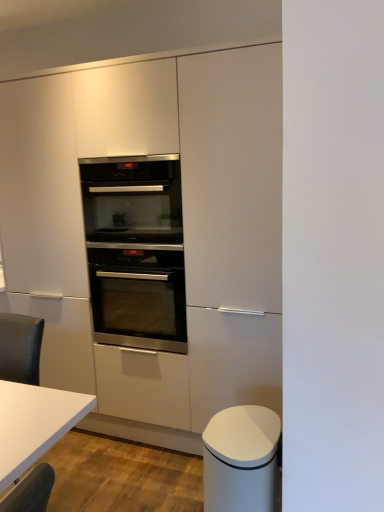
Question: Does satin white cabinet at center, the first cabinetry when ordered from back to front, have a larger size compared to white matte trash can at lower right, marked as the 2th cabinetry in a back-to-front arrangement?

Choices:
 (A) yes
 (B) no

Answer: (A)

Question: Considering the relative sizes of satin white cabinet at center, the first cabinetry when ordered from back to front, and white matte trash can at lower right, marked as the 2th cabinetry in a back-to-front arrangement, in the image provided, is satin white cabinet at center, the first cabinetry when ordered from back to front, taller than white matte trash can at lower right, marked as the 2th cabinetry in a back-to-front arrangement,?

Choices:
 (A) yes
 (B) no

Answer: (A)

Question: Is satin white cabinet at center, the 2th cabinetry viewed from the front, wider than white matte trash can at lower right, the first cabinetry from the front?

Choices:
 (A) no
 (B) yes

Answer: (B)

Question: Could you tell me if satin white cabinet at center, the first cabinetry when ordered from back to front, is facing white matte trash can at lower right, the first cabinetry from the front?

Choices:
 (A) no
 (B) yes

Answer: (B)

Question: From the image's perspective, is satin white cabinet at center, the 2th cabinetry viewed from the front, under white matte trash can at lower right, marked as the 2th cabinetry in a back-to-front arrangement?

Choices:
 (A) yes
 (B) no

Answer: (B)

Question: Is point (231, 463) positioned closer to the camera than point (155, 168)?

Choices:
 (A) closer
 (B) farther

Answer: (A)

Question: Is white matte trash can at lower right, marked as the 2th cabinetry in a back-to-front arrangement, to the left or to the right of stainless steel oven at center, which appears as the first oven when viewed from the top, in the image?

Choices:
 (A) left
 (B) right

Answer: (B)

Question: From a real-world perspective, is white matte trash can at lower right, the first cabinetry from the front, positioned above or below stainless steel oven at center, which ranks as the second oven in bottom-to-top order?

Choices:
 (A) above
 (B) below

Answer: (B)

Question: In terms of size, does white matte trash can at lower right, the first cabinetry from the front, appear bigger or smaller than stainless steel oven at center, which ranks as the second oven in bottom-to-top order?

Choices:
 (A) small
 (B) big

Answer: (A)

Question: Considering the positions of point (102, 316) and point (89, 399), is point (102, 316) closer or farther from the camera than point (89, 399)?

Choices:
 (A) closer
 (B) farther

Answer: (B)

Question: Considering the positions of stainless steel oven at center, positioned as the 1th oven in bottom-to-top order, and white glossy table at lower left in the image, is stainless steel oven at center, positioned as the 1th oven in bottom-to-top order, taller or shorter than white glossy table at lower left?

Choices:
 (A) tall
 (B) short

Answer: (B)

Question: From a real-world perspective, is stainless steel oven at center, positioned as the 1th oven in bottom-to-top order, above or below white glossy table at lower left?

Choices:
 (A) above
 (B) below

Answer: (A)

Question: Considering their positions, is stainless steel oven at center, acting as the second oven starting from the top, located in front of or behind white glossy table at lower left?

Choices:
 (A) front
 (B) behind

Answer: (B)

Question: Is satin white cabinet at center, the first cabinetry when ordered from back to front, inside or outside of white matte trash can at lower right, marked as the 2th cabinetry in a back-to-front arrangement?

Choices:
 (A) outside
 (B) inside

Answer: (A)

Question: From the image's perspective, relative to white matte trash can at lower right, marked as the 2th cabinetry in a back-to-front arrangement, is satin white cabinet at center, the first cabinetry when ordered from back to front, above or below?

Choices:
 (A) above
 (B) below

Answer: (A)